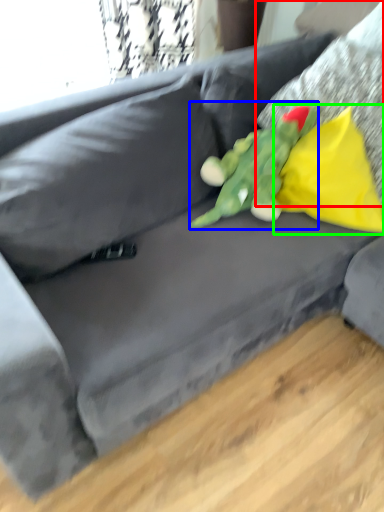
Question: Considering the real-world distances, which object is closest to pillow (highlighted by a red box)? toy (highlighted by a blue box) or pillow (highlighted by a green box).

Choices:
 (A) toy
 (B) pillow

Answer: (B)